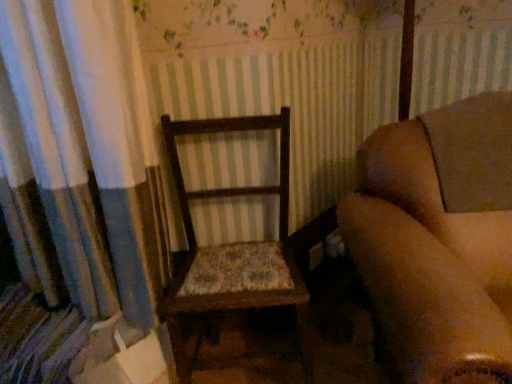
Question: Based on their positions, is wooden chair with floral cushion at center located to the left or right of wooden chair at center?

Choices:
 (A) right
 (B) left

Answer: (B)

Question: Is wooden chair with floral cushion at center wider or thinner than wooden chair at center?

Choices:
 (A) thin
 (B) wide

Answer: (A)

Question: Choose the correct answer: Is wooden chair with floral cushion at center inside wooden chair at center or outside it?

Choices:
 (A) outside
 (B) inside

Answer: (A)

Question: From the image's perspective, relative to wooden chair with floral cushion at center, is wooden chair at center above or below?

Choices:
 (A) above
 (B) below

Answer: (B)

Question: Based on their sizes in the image, would you say wooden chair at center is bigger or smaller than wooden chair with floral cushion at center?

Choices:
 (A) small
 (B) big

Answer: (B)

Question: Does point (455, 276) appear closer or farther from the camera than point (253, 248)?

Choices:
 (A) closer
 (B) farther

Answer: (A)

Question: Considering the positions of wooden chair at center and wooden chair with floral cushion at center in the image, is wooden chair at center wider or thinner than wooden chair with floral cushion at center?

Choices:
 (A) thin
 (B) wide

Answer: (B)